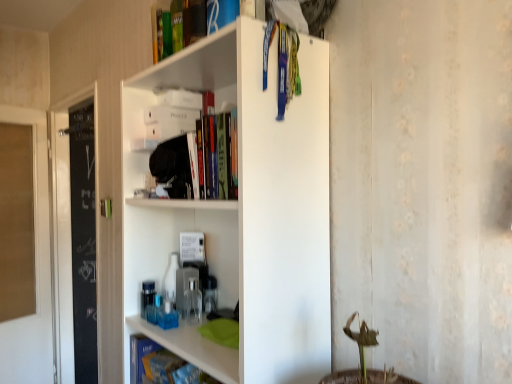
Question: Is white matte shelf at upper center facing towards blue matte book at lower left, which is counted as the second book, starting from the bottom?

Choices:
 (A) yes
 (B) no

Answer: (A)

Question: Is blue matte book at lower left, which is counted as the second book, starting from the bottom, at the back of white matte shelf at upper center?

Choices:
 (A) yes
 (B) no

Answer: (A)

Question: Does white matte shelf at upper center appear on the right side of blue matte book at lower left, which is counted as the second book, starting from the bottom?

Choices:
 (A) yes
 (B) no

Answer: (A)

Question: Is white matte shelf at upper center far from blue matte book at lower left, the second book positioned from the top?

Choices:
 (A) no
 (B) yes

Answer: (A)

Question: Is the position of white matte shelf at upper center less distant than that of blue matte book at lower left, the second book positioned from the top?

Choices:
 (A) no
 (B) yes

Answer: (B)

Question: From the image's perspective, is blue matte book at lower left, which is counted as the second book, starting from the bottom, positioned above or below transparent glass door at left?

Choices:
 (A) above
 (B) below

Answer: (B)

Question: Does point (169, 352) appear closer or farther from the camera than point (46, 299)?

Choices:
 (A) farther
 (B) closer

Answer: (B)

Question: Looking at the image, does blue matte book at lower left, which is counted as the second book, starting from the bottom, seem bigger or smaller compared to transparent glass door at left?

Choices:
 (A) small
 (B) big

Answer: (A)

Question: In the image, is blue matte book at lower left, the second book positioned from the top, on the left side or the right side of transparent glass door at left?

Choices:
 (A) left
 (B) right

Answer: (B)

Question: Considering the positions of point [197, 6] and point [154, 377], is point [197, 6] closer or farther from the camera than point [154, 377]?

Choices:
 (A) closer
 (B) farther

Answer: (A)

Question: Is green matte book at upper center, placed as the first book when sorted from top to bottom, wider or thinner than blue matte book at lower left, which is counted as the second book, starting from the bottom?

Choices:
 (A) thin
 (B) wide

Answer: (B)

Question: In the image, is green matte book at upper center, placed as the first book when sorted from top to bottom, positioned in front of or behind blue matte book at lower left, the second book positioned from the top?

Choices:
 (A) front
 (B) behind

Answer: (A)

Question: From the image's perspective, is green matte book at upper center, placed as the first book when sorted from top to bottom, located above or below blue matte book at lower left, which is counted as the second book, starting from the bottom?

Choices:
 (A) above
 (B) below

Answer: (A)

Question: Considering the positions of blue matte book at lower left, the second book positioned from the top, and white matte shelf at upper center in the image, is blue matte book at lower left, the second book positioned from the top, bigger or smaller than white matte shelf at upper center?

Choices:
 (A) big
 (B) small

Answer: (B)

Question: Relative to white matte shelf at upper center, is blue matte book at lower left, which is counted as the second book, starting from the bottom, in front or behind?

Choices:
 (A) front
 (B) behind

Answer: (B)